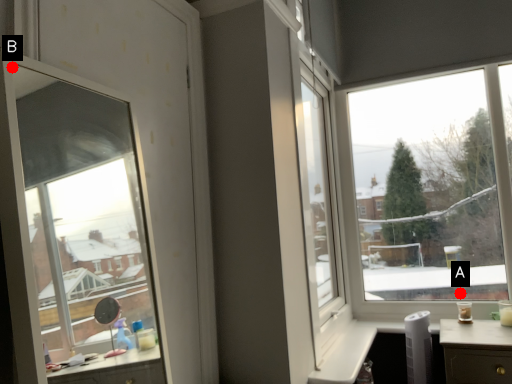
Question: Two points are circled on the image, labeled by A and B beside each circle. Among these points, which one is nearest to the camera?

Choices:
 (A) A is closer
 (B) B is closer

Answer: (B)